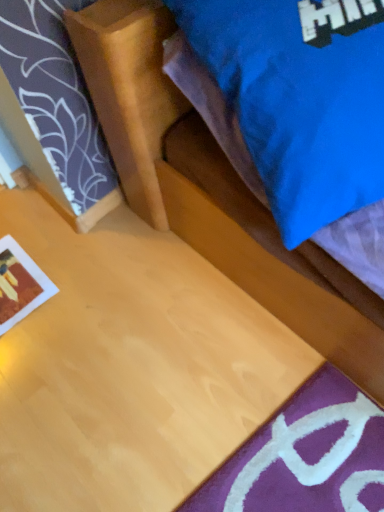
At what (x,y) coordinates should I click in order to perform the action: click on free point below matte paper print at lower left (from a real-world perspective). Please return your answer as a coordinate pair (x, y). This screenshot has width=384, height=512. Looking at the image, I should click on (16, 290).